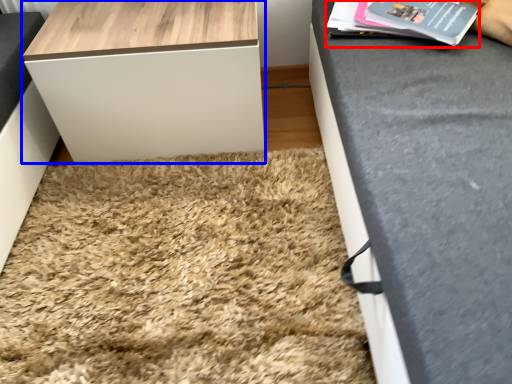
Question: Among these objects, which one is farthest to the camera, magazine (highlighted by a red box) or table (highlighted by a blue box)?

Choices:
 (A) magazine
 (B) table

Answer: (B)